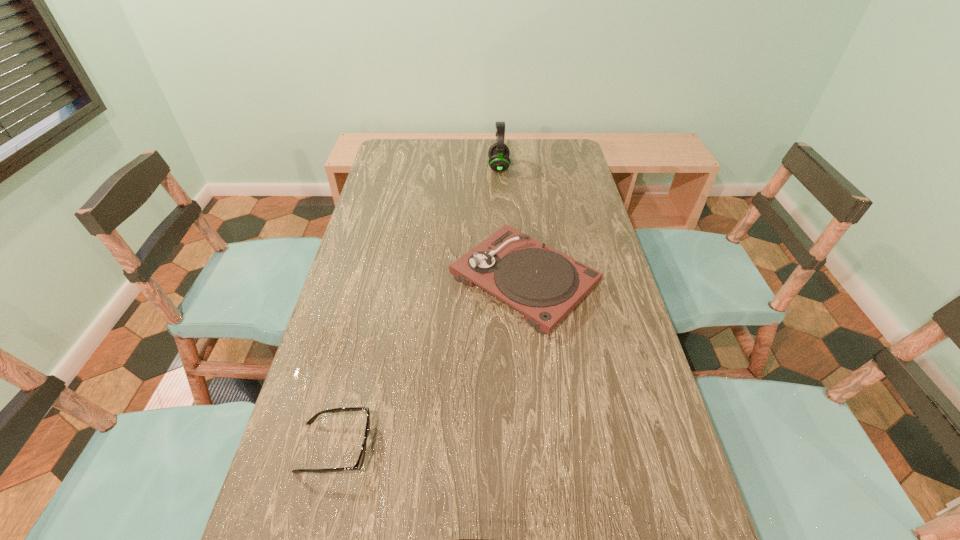
At what (x,y) coordinates should I click in order to perform the action: click on free space located 0.250m on the lenses of the left spectacles. Please return your answer as a coordinate pair (x, y). Looking at the image, I should click on (491, 447).

You are a GUI agent. You are given a task and a screenshot of the screen. Output one action in this format:
    pyautogui.click(x=<x>, y=<y>)
    Task: Click on the object positioned at the far edge
    This screenshot has height=540, width=960.
    Given the screenshot: What is the action you would take?
    pyautogui.click(x=498, y=153)

Find the location of `object located at the left edge`. object located at the left edge is located at coordinates (360, 461).

The width and height of the screenshot is (960, 540). What are the coordinates of `object located in the right edge section of the desktop` in the screenshot? It's located at (545, 285).

Where is `vacant area at the far edge of the desktop`? This screenshot has width=960, height=540. vacant area at the far edge of the desktop is located at coordinates (444, 166).

Identify the location of vacant region at the left edge. The image size is (960, 540). (373, 382).

You are a GUI agent. You are given a task and a screenshot of the screen. Output one action in this format:
    pyautogui.click(x=<x>, y=<y>)
    Task: Click on the vacant space at the right edge
    Image resolution: width=960 pixels, height=540 pixels.
    Given the screenshot: What is the action you would take?
    pyautogui.click(x=642, y=347)

The width and height of the screenshot is (960, 540). I want to click on vacant region at the far left corner of the desktop, so click(401, 163).

At what (x,y) coordinates should I click in order to perform the action: click on vacant space at the far right corner of the desktop. Please return your answer as a coordinate pair (x, y). Looking at the image, I should click on (550, 165).

This screenshot has height=540, width=960. I want to click on vacant space that's between the tallest object and the second tallest object, so click(512, 224).